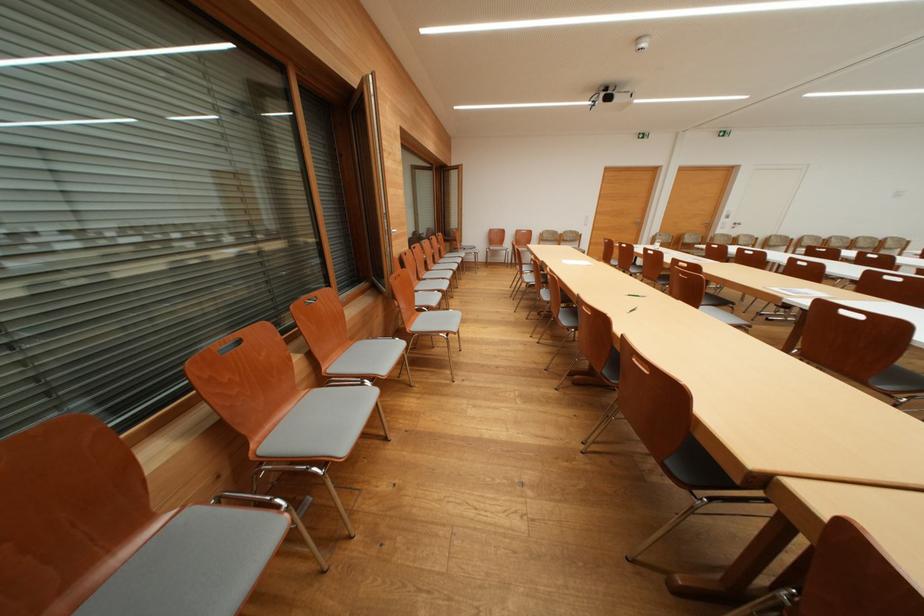
This screenshot has height=616, width=924. What do you see at coordinates (736, 224) in the screenshot?
I see `a window handle` at bounding box center [736, 224].